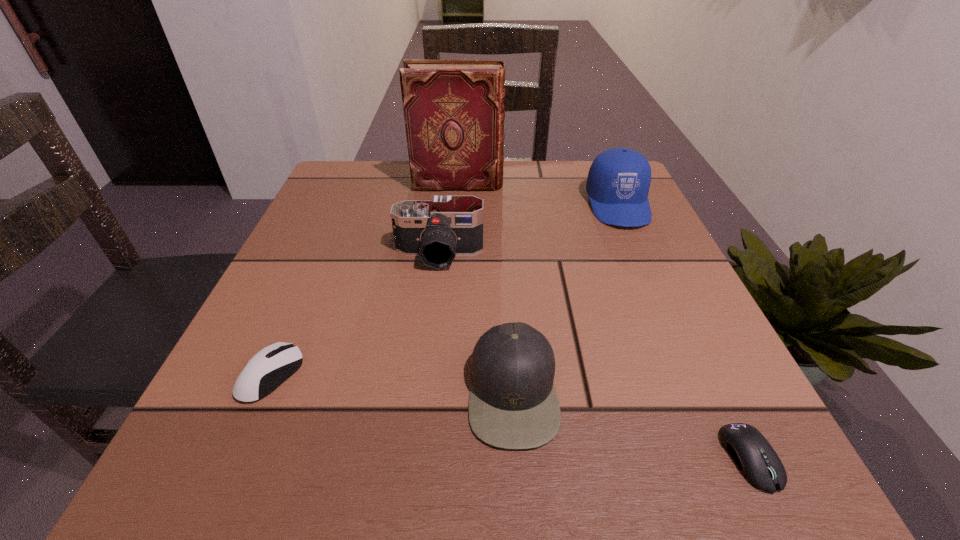
Find the location of `free space at the right edge of the desktop`. free space at the right edge of the desktop is located at coordinates (639, 246).

Locate an element on the screen. vacant area at the far left corner of the desktop is located at coordinates (360, 212).

You are a GUI agent. You are given a task and a screenshot of the screen. Output one action in this format:
    pyautogui.click(x=<x>, y=<y>)
    Task: Click on the free space at the far right corner
    This screenshot has width=960, height=540.
    Given the screenshot: What is the action you would take?
    pyautogui.click(x=580, y=171)

Identify the location of blank region between the hardback book and the shortest object. (605, 321).

Identify the location of free space that is in between the shorter cap and the camera. This screenshot has height=540, width=960. (476, 323).

At what (x,y) coordinates should I click in order to perform the action: click on free space between the right cap and the taller computer equipment. Please return your answer as a coordinate pair (x, y). The width and height of the screenshot is (960, 540). Looking at the image, I should click on (444, 290).

Where is `free space between the nearer computer equipment and the taller cap`? This screenshot has width=960, height=540. free space between the nearer computer equipment and the taller cap is located at coordinates (684, 331).

Where is `free area in between the third farthest object and the left cap`? This screenshot has width=960, height=540. free area in between the third farthest object and the left cap is located at coordinates (476, 323).

Locate an element on the screen. Image resolution: width=960 pixels, height=540 pixels. vacant point located between the shorter computer equipment and the fourth nearest object is located at coordinates (595, 356).

Image resolution: width=960 pixels, height=540 pixels. What are the coordinates of `free space between the hardback book and the right cap` in the screenshot? It's located at (539, 194).